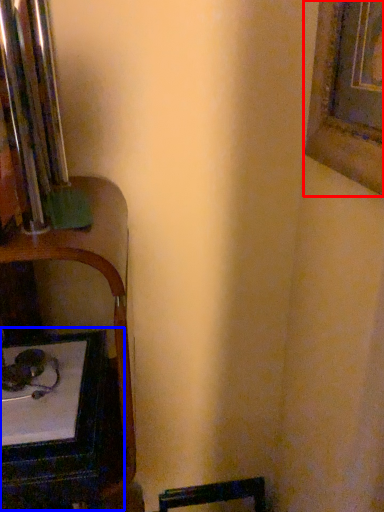
Question: Among these objects, which one is nearest to the camera, picture frame (highlighted by a red box) or table (highlighted by a blue box)?

Choices:
 (A) picture frame
 (B) table

Answer: (A)